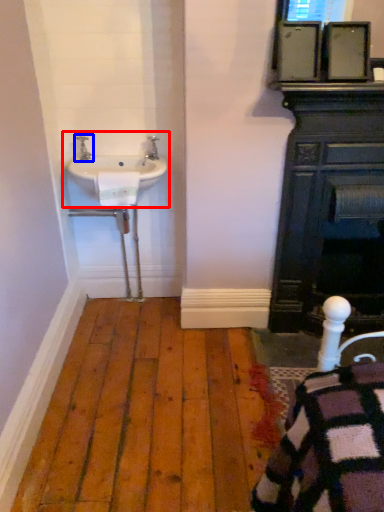
Question: Among these objects, which one is farthest to the camera, sink (highlighted by a red box) or tap (highlighted by a blue box)?

Choices:
 (A) sink
 (B) tap

Answer: (B)